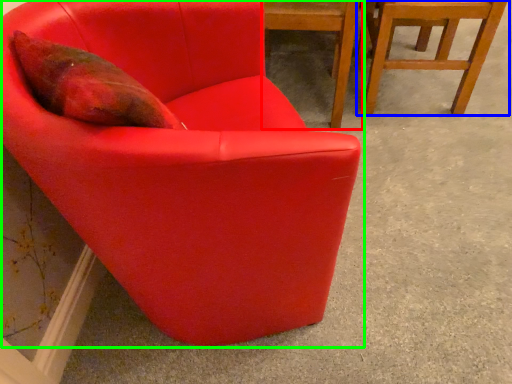
Question: Which object is positioned farthest from chair (highlighted by a red box)? Select from chair (highlighted by a blue box) and chair (highlighted by a green box).

Choices:
 (A) chair
 (B) chair

Answer: (B)